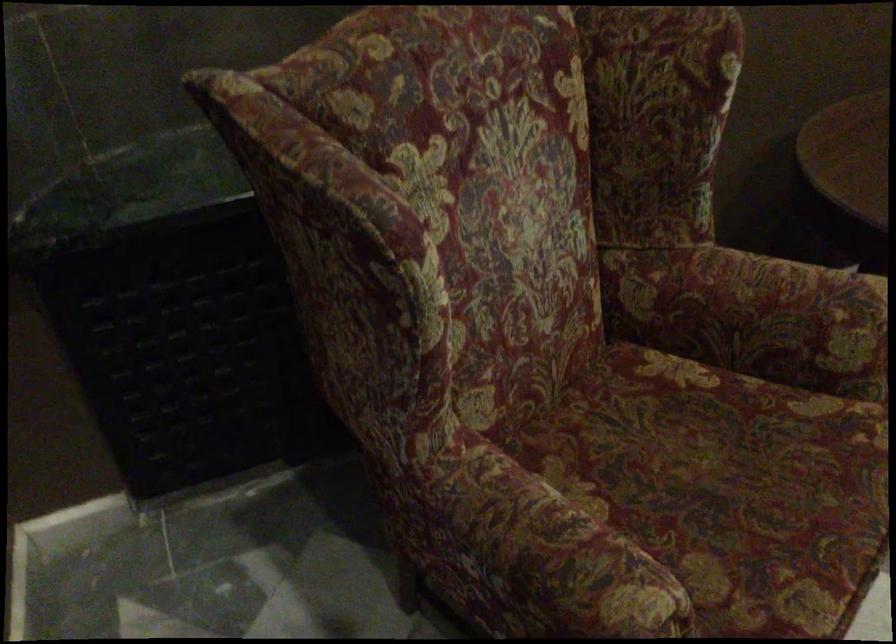
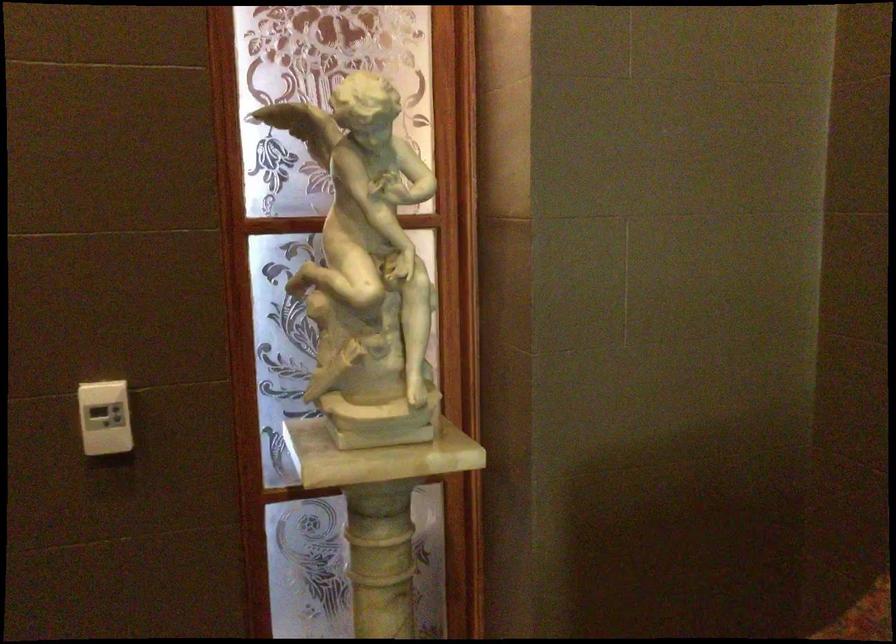
Question: The camera is either moving clockwise (left) or counter-clockwise (right) around the object. The first image is from the beginning of the video and the second image is from the end. Is the camera moving left or right when shooting the video?

Choices:
 (A) Left
 (B) Right

Answer: (B)